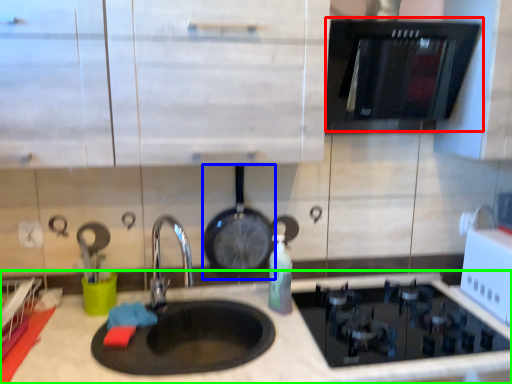
Question: Which object is positioned closest to oven (highlighted by a red box)? Select from wok (highlighted by a blue box) and countertop (highlighted by a green box).

Choices:
 (A) wok
 (B) countertop

Answer: (A)